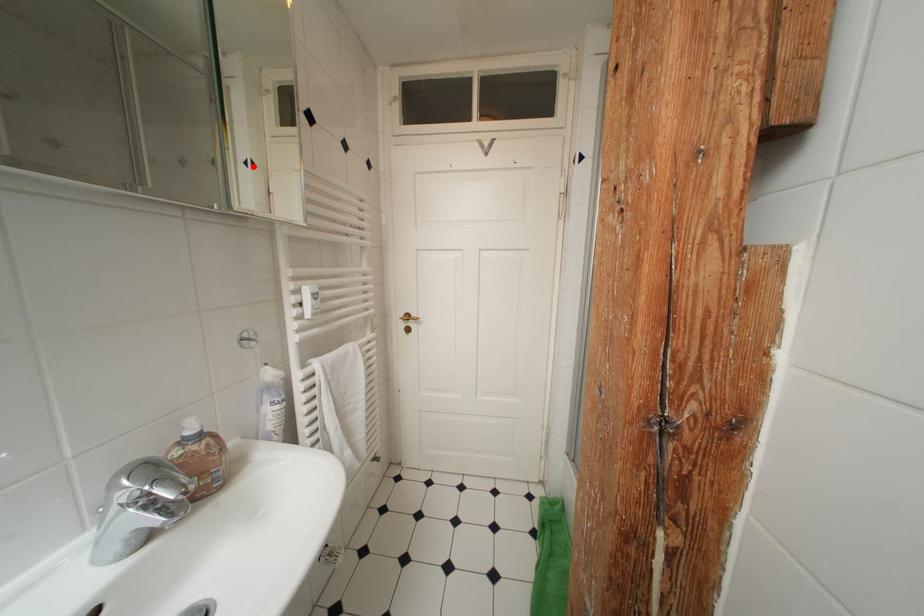
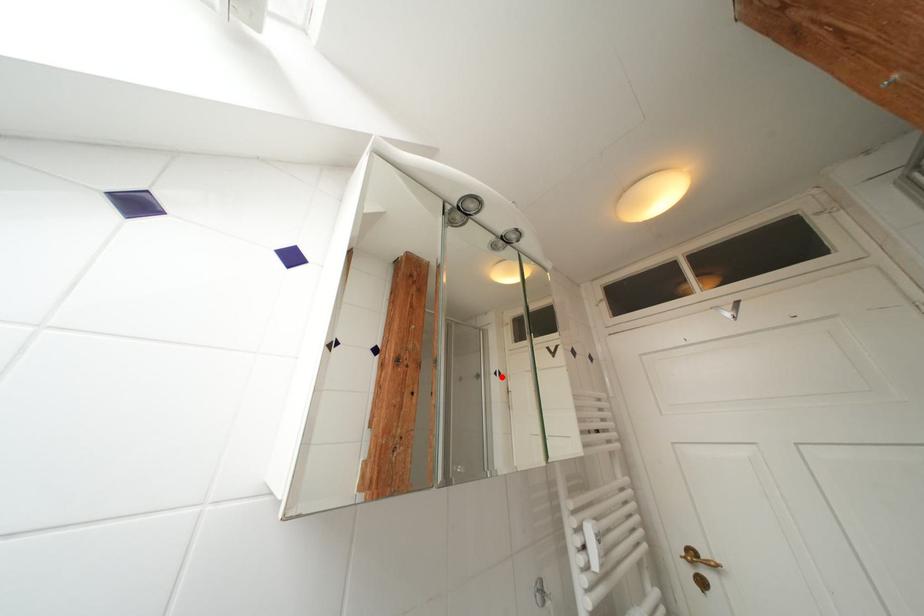
I am providing you with two images of the same scene from different viewpoints. A red point is marked on the first image and another point is marked on the second image. Is the red point in image1 aligned with the point shown in image2?

Yes